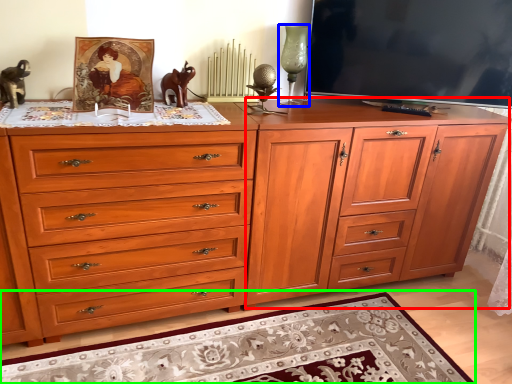
Question: Considering the real-world distances, which object is closest to file cabinet (highlighted by a red box)? candle holder (highlighted by a blue box) or mat (highlighted by a green box).

Choices:
 (A) candle holder
 (B) mat

Answer: (B)